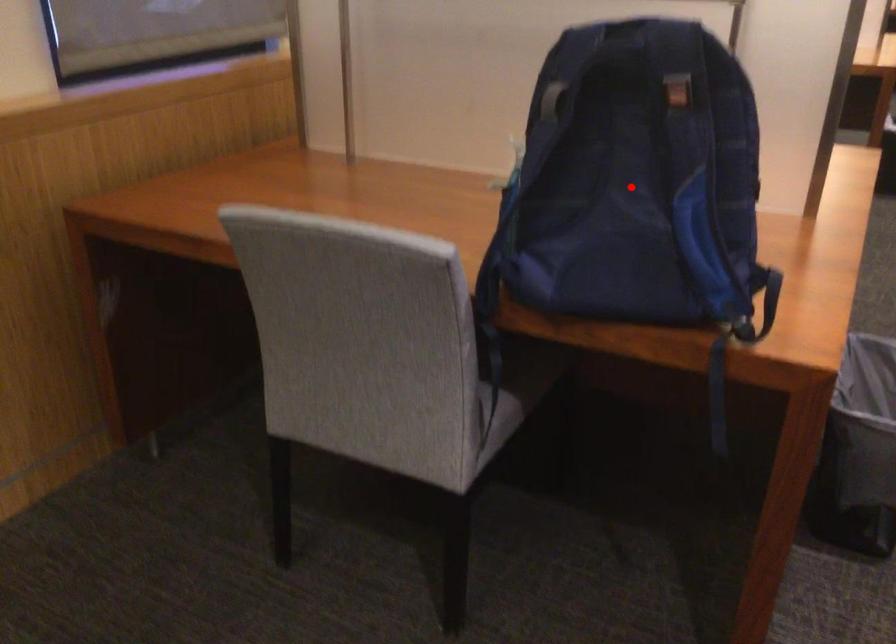
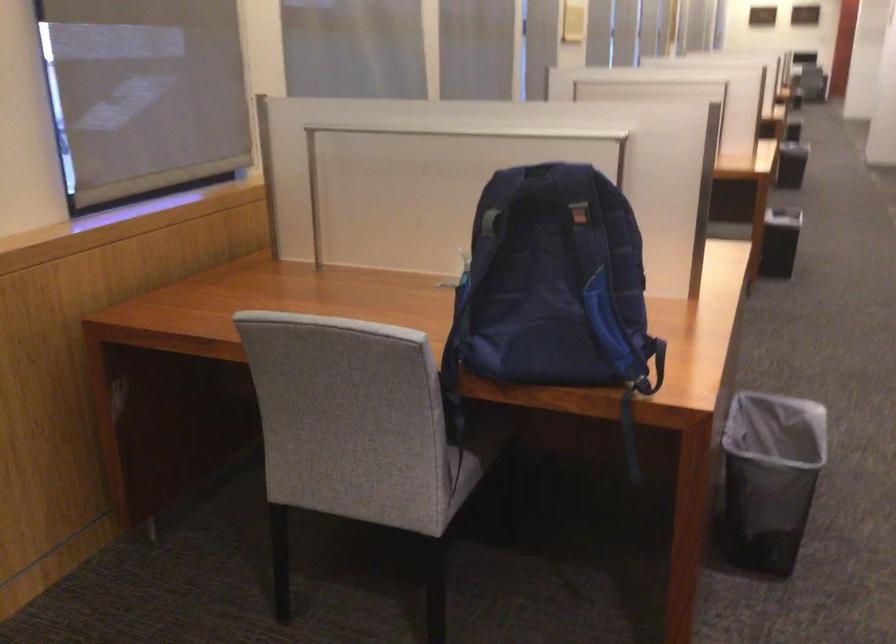
The point at the highlighted location is marked in the first image. Where is the corresponding point in the second image?

(552, 281)